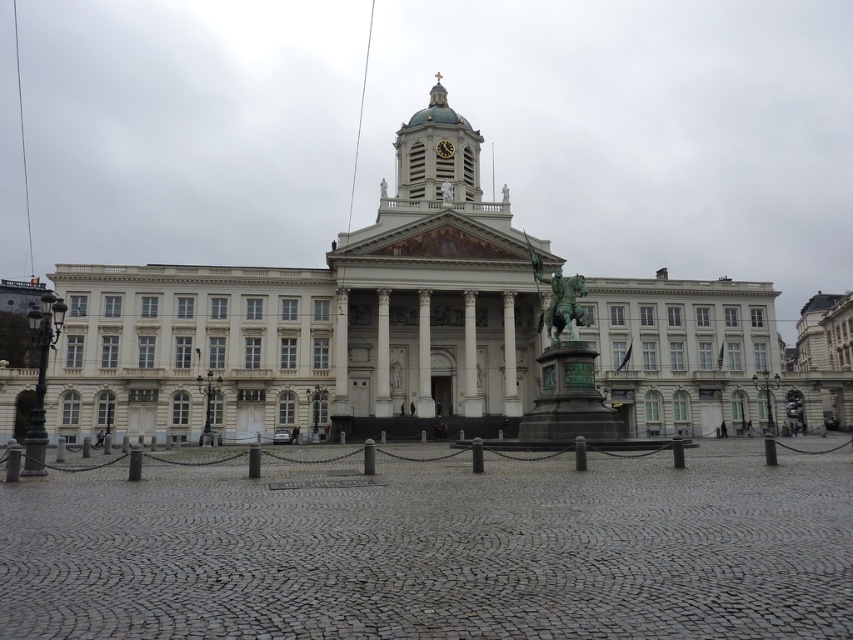
You are a tour guide explaining the architectural features of the white marble palace at center and the bronze statue at center. Which one is bigger in size?

The white marble palace at center is larger in size compared to the bronze statue at center.